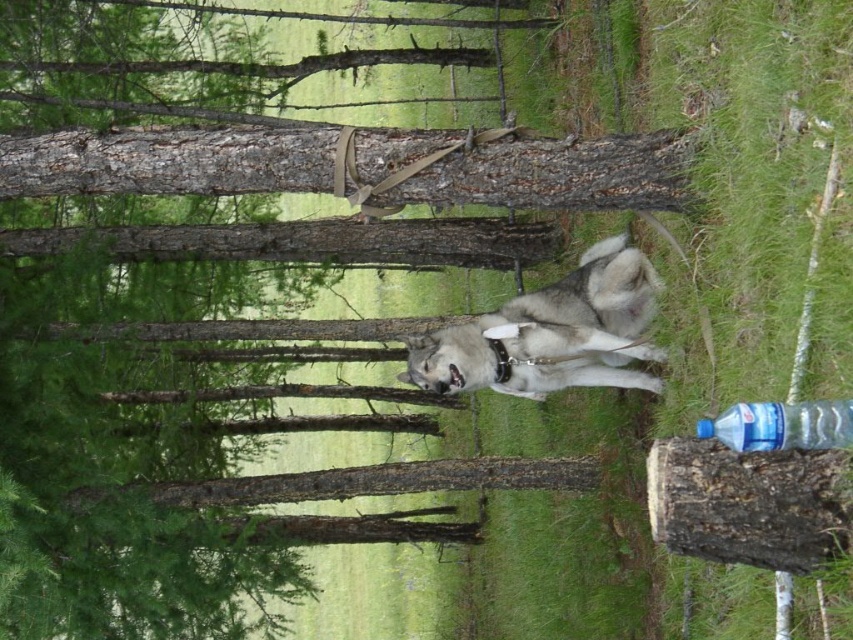
You are a hiker who wants to take a photo of the white fur dog at center. You are standing at point [590,294]. Is the white fur dog at center in your line of sight?

The white fur dog at center is located at point [590,294], so yes, the dog is directly at your current position, meaning it is in your line of sight.

You are a hiker who has spotted the white fur dog at center and the clear plastic bottle at lower right in the forest. Which object is closer to you?

The white fur dog at center is closer to you because it is positioned over the clear plastic bottle at lower right, indicating it is in front of the bottle.

You are standing in the forest and see two points marked in the image. Which point is closer to you, point [651,348] or point [740,436]?

Point [651,348] is further to the viewer than point [740,436], so point [740,436] is closer to you.